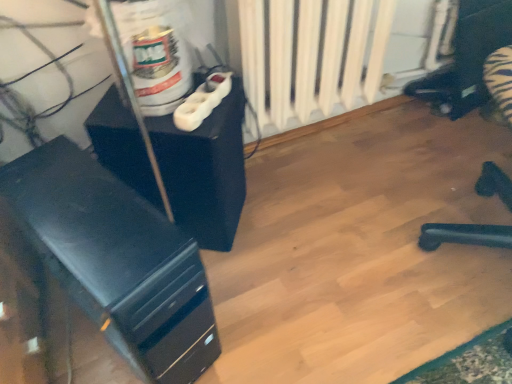
Describe the element at coordinates (117, 260) in the screenshot. The height and width of the screenshot is (384, 512). I see `black matte computer tower at left, which ranks as the 1th furniture in bottom-to-top order` at that location.

Measure the distance between point (x=332, y=33) and camera.

The depth of point (x=332, y=33) is 3.83 feet.

What do you see at coordinates (205, 171) in the screenshot?
I see `matte black cabinet at center-left, placed as the first furniture when sorted from top to bottom` at bounding box center [205, 171].

The height and width of the screenshot is (384, 512). I want to click on black matte computer tower at left, which is counted as the 2th furniture, starting from the top, so (x=117, y=260).

Is white plastic plug at upper center turned away from black matte computer tower at left, which is counted as the 2th furniture, starting from the top?

white plastic plug at upper center does not have its back to black matte computer tower at left, which is counted as the 2th furniture, starting from the top.

In the scene shown: Can you tell me how much white plastic plug at upper center and black matte computer tower at left, which ranks as the 1th furniture in bottom-to-top order, differ in facing direction?

17.2 degrees.

From the image's perspective, is white plastic plug at upper center above or below black matte computer tower at left, which ranks as the 1th furniture in bottom-to-top order?

white plastic plug at upper center is situated higher than black matte computer tower at left, which ranks as the 1th furniture in bottom-to-top order, in the image.

Can you confirm if white plastic plug at upper center is thinner than black matte computer tower at left, which ranks as the 1th furniture in bottom-to-top order?

Correct, the width of white plastic plug at upper center is less than that of black matte computer tower at left, which ranks as the 1th furniture in bottom-to-top order.

Is white matte radiator at center inside or outside of black matte computer tower at left, which ranks as the 1th furniture in bottom-to-top order?

The correct answer is: outside.

Is point (279, 58) farther from camera compared to point (147, 359)?

Yes, it is behind point (147, 359).

How much distance is there between white matte radiator at center and black matte computer tower at left, which is counted as the 2th furniture, starting from the top?

A distance of 24.90 inches exists between white matte radiator at center and black matte computer tower at left, which is counted as the 2th furniture, starting from the top.

From a real-world perspective, who is located lower, white matte radiator at center or white plastic plug at upper center?

From a 3D spatial view, white matte radiator at center is below.

Measure the distance from white matte radiator at center to white plastic plug at upper center.

The distance of white matte radiator at center from white plastic plug at upper center is 11.87 inches.

Which is more to the left, white matte radiator at center or white plastic plug at upper center?

Positioned to the left is white plastic plug at upper center.

Does white matte radiator at center have a smaller size compared to white plastic plug at upper center?

Incorrect, white matte radiator at center is not smaller in size than white plastic plug at upper center.

Which is more to the left, white plastic plug at upper center or white matte radiator at center?

From the viewer's perspective, white plastic plug at upper center appears more on the left side.

Is white plastic plug at upper center surrounding white matte radiator at center?

That's incorrect, white matte radiator at center is not inside white plastic plug at upper center.

Find the location of a particular element. The width and height of the screenshot is (512, 384). plug above the white matte radiator at center (from a real-world perspective) is located at coordinates (203, 101).

Can you confirm if white plastic plug at upper center is taller than white matte radiator at center?

No.

Is matte black cabinet at center-left, which appears as the second furniture when ordered from the bottom, at the left side of white plastic plug at upper center?

Correct, you'll find matte black cabinet at center-left, which appears as the second furniture when ordered from the bottom, to the left of white plastic plug at upper center.

Consider the image. Would you say matte black cabinet at center-left, placed as the first furniture when sorted from top to bottom, contains white plastic plug at upper center?

That's incorrect, white plastic plug at upper center is not inside matte black cabinet at center-left, placed as the first furniture when sorted from top to bottom.

Does matte black cabinet at center-left, placed as the first furniture when sorted from top to bottom, touch white plastic plug at upper center?

matte black cabinet at center-left, placed as the first furniture when sorted from top to bottom, and white plastic plug at upper center are not in contact.

Is black matte computer tower at left, which ranks as the 1th furniture in bottom-to-top order, positioned with its back to white matte radiator at center?

No, black matte computer tower at left, which ranks as the 1th furniture in bottom-to-top order,'s orientation is not away from white matte radiator at center.

Is white matte radiator at center inside black matte computer tower at left, which is counted as the 2th furniture, starting from the top?

No, white matte radiator at center is located outside of black matte computer tower at left, which is counted as the 2th furniture, starting from the top.

From the picture: Is black matte computer tower at left, which ranks as the 1th furniture in bottom-to-top order, smaller than white matte radiator at center?

Correct, black matte computer tower at left, which ranks as the 1th furniture in bottom-to-top order, occupies less space than white matte radiator at center.

What's the angular difference between black matte computer tower at left, which is counted as the 2th furniture, starting from the top, and white matte radiator at center's facing directions?

black matte computer tower at left, which is counted as the 2th furniture, starting from the top, and white matte radiator at center are facing 18.5 degrees away from each other.

Where is `the 1st furniture to the left when counting from the white matte radiator at center`? The width and height of the screenshot is (512, 384). the 1st furniture to the left when counting from the white matte radiator at center is located at coordinates (205, 171).

How different are the orientations of matte black cabinet at center-left, which appears as the second furniture when ordered from the bottom, and white matte radiator at center in degrees?

49.9 degrees.

Is matte black cabinet at center-left, which appears as the second furniture when ordered from the bottom, smaller than white matte radiator at center?

Yes.

Considering the points (117, 109) and (280, 131), which point is behind, point (117, 109) or point (280, 131)?

Point (280, 131)

There is a white plastic plug at upper center. Identify the location of the 1st furniture below it (from a real-world perspective). The width and height of the screenshot is (512, 384). (117, 260).

Where is `radiator above the black matte computer tower at left, which is counted as the 2th furniture, starting from the top (from a real-world perspective)`? This screenshot has height=384, width=512. radiator above the black matte computer tower at left, which is counted as the 2th furniture, starting from the top (from a real-world perspective) is located at coordinates (311, 56).

Looking at the image, which one is located closer to white matte radiator at center, white plastic plug at upper center or black matte computer tower at left, which is counted as the 2th furniture, starting from the top?

white plastic plug at upper center is positioned closer to the anchor white matte radiator at center.

In the scene shown: When comparing their distances from matte black cabinet at center-left, placed as the first furniture when sorted from top to bottom, does black matte computer tower at left, which ranks as the 1th furniture in bottom-to-top order, or white matte radiator at center seem further?

Among the two, white matte radiator at center is located further to matte black cabinet at center-left, placed as the first furniture when sorted from top to bottom.

From the picture: Looking at the image, which one is located further to white matte radiator at center, matte black cabinet at center-left, placed as the first furniture when sorted from top to bottom, or black matte computer tower at left, which ranks as the 1th furniture in bottom-to-top order?

The object further to white matte radiator at center is black matte computer tower at left, which ranks as the 1th furniture in bottom-to-top order.

Estimate the real-world distances between objects in this image. Which object is further from white plastic plug at upper center, matte black cabinet at center-left, which appears as the second furniture when ordered from the bottom, or black matte computer tower at left, which ranks as the 1th furniture in bottom-to-top order?

The object further to white plastic plug at upper center is black matte computer tower at left, which ranks as the 1th furniture in bottom-to-top order.

Looking at the image, which one is located further to matte black cabinet at center-left, placed as the first furniture when sorted from top to bottom, white plastic plug at upper center or white matte radiator at center?

white matte radiator at center is further to matte black cabinet at center-left, placed as the first furniture when sorted from top to bottom.

From the image, which object appears to be farther from matte black cabinet at center-left, which appears as the second furniture when ordered from the bottom, white matte radiator at center or white plastic plug at upper center?

white matte radiator at center is positioned further to the anchor matte black cabinet at center-left, which appears as the second furniture when ordered from the bottom.

From the image, which object appears to be farther from black matte computer tower at left, which is counted as the 2th furniture, starting from the top, matte black cabinet at center-left, which appears as the second furniture when ordered from the bottom, or white plastic plug at upper center?

Based on the image, white plastic plug at upper center appears to be further to black matte computer tower at left, which is counted as the 2th furniture, starting from the top.

From the image, which object appears to be nearer to white plastic plug at upper center, black matte computer tower at left, which ranks as the 1th furniture in bottom-to-top order, or white matte radiator at center?

white matte radiator at center is positioned closer to the anchor white plastic plug at upper center.

Find the location of a particular element. The height and width of the screenshot is (384, 512). furniture between white plastic plug at upper center and black matte computer tower at left, which is counted as the 2th furniture, starting from the top, in the vertical direction is located at coordinates (205, 171).

Image resolution: width=512 pixels, height=384 pixels. Find the location of `plug between matte black cabinet at center-left, placed as the first furniture when sorted from top to bottom, and white matte radiator at center`. plug between matte black cabinet at center-left, placed as the first furniture when sorted from top to bottom, and white matte radiator at center is located at coordinates (203, 101).

Where is `plug between white matte radiator at center and black matte computer tower at left, which is counted as the 2th furniture, starting from the top, in the vertical direction`? Image resolution: width=512 pixels, height=384 pixels. plug between white matte radiator at center and black matte computer tower at left, which is counted as the 2th furniture, starting from the top, in the vertical direction is located at coordinates (203, 101).

Where is `furniture situated between black matte computer tower at left, which ranks as the 1th furniture in bottom-to-top order, and white matte radiator at center from left to right`? The image size is (512, 384). furniture situated between black matte computer tower at left, which ranks as the 1th furniture in bottom-to-top order, and white matte radiator at center from left to right is located at coordinates (205, 171).